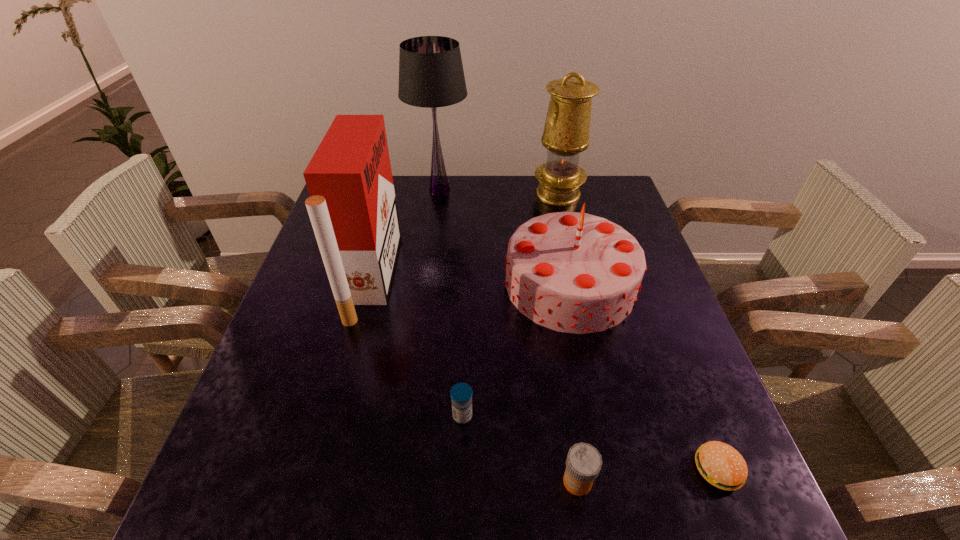
The image size is (960, 540). Identify the location of lampshade. (431, 75).

Image resolution: width=960 pixels, height=540 pixels. What are the coordinates of `oil lamp` in the screenshot? It's located at (566, 133).

This screenshot has width=960, height=540. Identify the location of cigarette case. (352, 206).

This screenshot has height=540, width=960. Identify the location of the fourth tallest object. (572, 272).

Find the location of a particular element. This screenshot has width=960, height=540. the nearer medicine is located at coordinates (583, 463).

At what (x,y) coordinates should I click in order to perform the action: click on the left medicine. Please return your answer as a coordinate pair (x, y). This screenshot has height=540, width=960. Looking at the image, I should click on (461, 393).

Locate an element on the screen. The width and height of the screenshot is (960, 540). the farther medicine is located at coordinates (461, 393).

Identify the location of patty. (721, 465).

Identify the location of free spot located 0.380m on the front-facing side of the lampshade. (427, 294).

Image resolution: width=960 pixels, height=540 pixels. What are the coordinates of `free space located on the left of the oil lamp` in the screenshot? It's located at (456, 194).